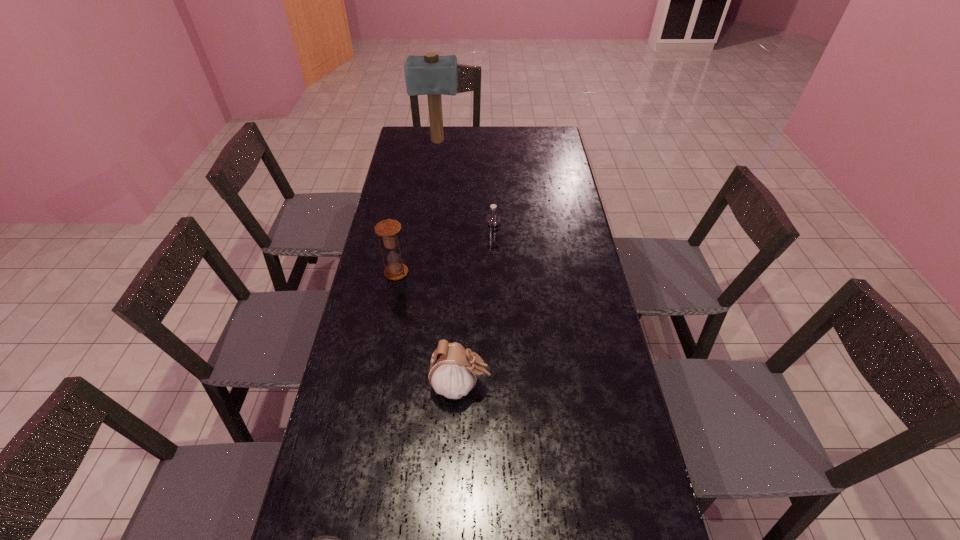
I want to click on mallet present at the left edge, so click(x=432, y=75).

Locate an element on the screen. The width and height of the screenshot is (960, 540). hourglass that is positioned at the left edge is located at coordinates (388, 229).

At what (x,y) coordinates should I click in order to perform the action: click on object that is at the far left corner. Please return your answer as a coordinate pair (x, y). Looking at the image, I should click on (432, 75).

At what (x,y) coordinates should I click in order to perform the action: click on vacant region at the far edge of the desktop. Please return your answer as a coordinate pair (x, y). Looking at the image, I should click on (492, 127).

Locate an element on the screen. Image resolution: width=960 pixels, height=540 pixels. free space at the left edge of the desktop is located at coordinates (426, 172).

In the image, there is a desktop. Identify the location of vacant space at the right edge. The width and height of the screenshot is (960, 540). (641, 488).

Find the location of a particular element. The image size is (960, 540). free space at the far left corner is located at coordinates (425, 138).

I want to click on vacant space at the far right corner of the desktop, so click(x=535, y=129).

Locate an element on the screen. vacant point located between the tallest object and the vodka is located at coordinates (465, 194).

You are a GUI agent. You are given a task and a screenshot of the screen. Output one action in this format:
    pyautogui.click(x=<x>, y=<y>)
    Task: Click on the free space between the tallest object and the vodka
    The width and height of the screenshot is (960, 540).
    Given the screenshot: What is the action you would take?
    pyautogui.click(x=465, y=194)